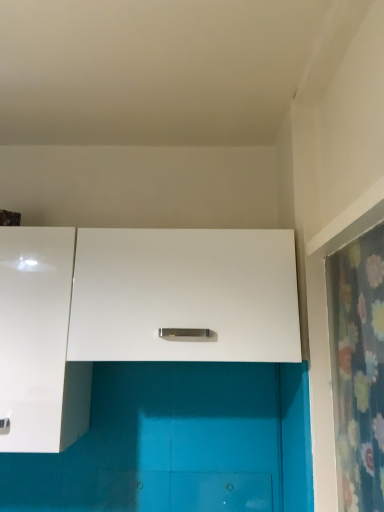
What is the approximate width of white matte cabinet at center, the 2th cabinetry from the left?

Answer: white matte cabinet at center, the 2th cabinetry from the left, is 13.89 inches wide.

This screenshot has width=384, height=512. What do you see at coordinates (184, 295) in the screenshot?
I see `white matte cabinet at center, which appears as the first cabinetry when viewed from the right` at bounding box center [184, 295].

This screenshot has height=512, width=384. Describe the element at coordinates (358, 369) in the screenshot. I see `floral fabric shower curtain at right` at that location.

This screenshot has width=384, height=512. I want to click on white glossy cabinet at left, placed as the first cabinetry when sorted from left to right, so click(39, 342).

Is white matte cabinet at center, which appears as the first cabinetry when viewed from the right, looking in the opposite direction of floral fabric shower curtain at right?

No, white matte cabinet at center, which appears as the first cabinetry when viewed from the right, is not facing the opposite direction of floral fabric shower curtain at right.

Between white matte cabinet at center, which appears as the first cabinetry when viewed from the right, and floral fabric shower curtain at right, which one has less height?

With less height is white matte cabinet at center, which appears as the first cabinetry when viewed from the right.

Can you confirm if white matte cabinet at center, the 2th cabinetry from the left, is positioned to the right of floral fabric shower curtain at right?

No, white matte cabinet at center, the 2th cabinetry from the left, is not to the right of floral fabric shower curtain at right.

From the image's perspective, between white matte cabinet at center, which appears as the first cabinetry when viewed from the right, and floral fabric shower curtain at right, which one is located above?

white matte cabinet at center, which appears as the first cabinetry when viewed from the right, appears higher in the image.

Based on the photo, is white matte cabinet at center, which appears as the first cabinetry when viewed from the right, completely or partially inside white glossy cabinet at left, placed as the first cabinetry when sorted from left to right?

That's incorrect, white matte cabinet at center, which appears as the first cabinetry when viewed from the right, is not inside white glossy cabinet at left, placed as the first cabinetry when sorted from left to right.

From a real-world perspective, which object rests below the other?

white glossy cabinet at left, the 2th cabinetry viewed from the right, from a real-world perspective.

Is white matte cabinet at center, the 2th cabinetry from the left, not close to white glossy cabinet at left, the 2th cabinetry viewed from the right?

Actually, white matte cabinet at center, the 2th cabinetry from the left, and white glossy cabinet at left, the 2th cabinetry viewed from the right, are a little close together.

Does white matte cabinet at center, which appears as the first cabinetry when viewed from the right, lie behind white glossy cabinet at left, the 2th cabinetry viewed from the right?

That is True.

From the image's perspective, which one is positioned lower, white matte cabinet at center, which appears as the first cabinetry when viewed from the right, or white glossy cabinet at left, placed as the first cabinetry when sorted from left to right?

white glossy cabinet at left, placed as the first cabinetry when sorted from left to right.

Measure the distance from white matte cabinet at center, the 2th cabinetry from the left, to white glossy cabinet at left, the 2th cabinetry viewed from the right.

They are 9.21 inches apart.

In terms of height, does white glossy cabinet at left, the 2th cabinetry viewed from the right, look taller or shorter compared to floral fabric shower curtain at right?

white glossy cabinet at left, the 2th cabinetry viewed from the right, is shorter than floral fabric shower curtain at right.

Measure the distance from white glossy cabinet at left, the 2th cabinetry viewed from the right, to floral fabric shower curtain at right.

The distance of white glossy cabinet at left, the 2th cabinetry viewed from the right, from floral fabric shower curtain at right is 73.99 centimeters.

Which is more to the left, white glossy cabinet at left, placed as the first cabinetry when sorted from left to right, or floral fabric shower curtain at right?

Positioned to the left is white glossy cabinet at left, placed as the first cabinetry when sorted from left to right.

From a real-world perspective, who is located higher, white glossy cabinet at left, the 2th cabinetry viewed from the right, or floral fabric shower curtain at right?

white glossy cabinet at left, the 2th cabinetry viewed from the right.

In the scene shown: From a real-world perspective, between floral fabric shower curtain at right and white glossy cabinet at left, placed as the first cabinetry when sorted from left to right, who is vertically higher?

From a 3D spatial view, white glossy cabinet at left, placed as the first cabinetry when sorted from left to right, is above.

Is white glossy cabinet at left, placed as the first cabinetry when sorted from left to right, surrounded by floral fabric shower curtain at right?

No, white glossy cabinet at left, placed as the first cabinetry when sorted from left to right, is not inside floral fabric shower curtain at right.

How many degrees apart are the facing directions of floral fabric shower curtain at right and white glossy cabinet at left, placed as the first cabinetry when sorted from left to right?

The angle between the facing direction of floral fabric shower curtain at right and the facing direction of white glossy cabinet at left, placed as the first cabinetry when sorted from left to right, is 90.8 degrees.

Is point (366, 428) less distant than point (15, 414)?

Yes, it is.

From the picture: Is there a large distance between floral fabric shower curtain at right and white matte cabinet at center, which appears as the first cabinetry when viewed from the right?

No, floral fabric shower curtain at right is in close proximity to white matte cabinet at center, which appears as the first cabinetry when viewed from the right.

Find the location of a particular element. The height and width of the screenshot is (512, 384). shower curtain below the white matte cabinet at center, which appears as the first cabinetry when viewed from the right (from a real-world perspective) is located at coordinates (358, 369).

How different are the orientations of floral fabric shower curtain at right and white matte cabinet at center, the 2th cabinetry from the left, in degrees?

Answer: There is a 90.8-degree angle between the facing directions of floral fabric shower curtain at right and white matte cabinet at center, the 2th cabinetry from the left.

Who is taller, floral fabric shower curtain at right or white matte cabinet at center, the 2th cabinetry from the left?

floral fabric shower curtain at right.

Locate an element on the screen. This screenshot has height=512, width=384. shower curtain on the right of white matte cabinet at center, the 2th cabinetry from the left is located at coordinates (358, 369).

The width and height of the screenshot is (384, 512). Find the location of `cabinetry that is under the white matte cabinet at center, the 2th cabinetry from the left (from a real-world perspective)`. cabinetry that is under the white matte cabinet at center, the 2th cabinetry from the left (from a real-world perspective) is located at coordinates (39, 342).

Considering their positions, is floral fabric shower curtain at right positioned closer to white matte cabinet at center, which appears as the first cabinetry when viewed from the right, than white glossy cabinet at left, the 2th cabinetry viewed from the right?

white glossy cabinet at left, the 2th cabinetry viewed from the right, is closer to white matte cabinet at center, which appears as the first cabinetry when viewed from the right.

When comparing their distances from floral fabric shower curtain at right, does white matte cabinet at center, the 2th cabinetry from the left, or white glossy cabinet at left, the 2th cabinetry viewed from the right, seem further?

Among the two, white glossy cabinet at left, the 2th cabinetry viewed from the right, is located further to floral fabric shower curtain at right.

From the image, which object appears to be farther from white matte cabinet at center, which appears as the first cabinetry when viewed from the right, white glossy cabinet at left, placed as the first cabinetry when sorted from left to right, or floral fabric shower curtain at right?

floral fabric shower curtain at right lies further to white matte cabinet at center, which appears as the first cabinetry when viewed from the right, than the other object.

From the image, which object appears to be nearer to white glossy cabinet at left, placed as the first cabinetry when sorted from left to right, white matte cabinet at center, the 2th cabinetry from the left, or floral fabric shower curtain at right?

white matte cabinet at center, the 2th cabinetry from the left, lies closer to white glossy cabinet at left, placed as the first cabinetry when sorted from left to right, than the other object.

Considering their positions, is floral fabric shower curtain at right positioned closer to white glossy cabinet at left, placed as the first cabinetry when sorted from left to right, than white matte cabinet at center, which appears as the first cabinetry when viewed from the right?

white matte cabinet at center, which appears as the first cabinetry when viewed from the right, is closer to white glossy cabinet at left, placed as the first cabinetry when sorted from left to right.

Based on their spatial positions, is white glossy cabinet at left, placed as the first cabinetry when sorted from left to right, or white matte cabinet at center, the 2th cabinetry from the left, further from floral fabric shower curtain at right?

Based on the image, white glossy cabinet at left, placed as the first cabinetry when sorted from left to right, appears to be further to floral fabric shower curtain at right.

Image resolution: width=384 pixels, height=512 pixels. I want to click on cabinetry located between white glossy cabinet at left, placed as the first cabinetry when sorted from left to right, and floral fabric shower curtain at right in the left-right direction, so click(x=184, y=295).